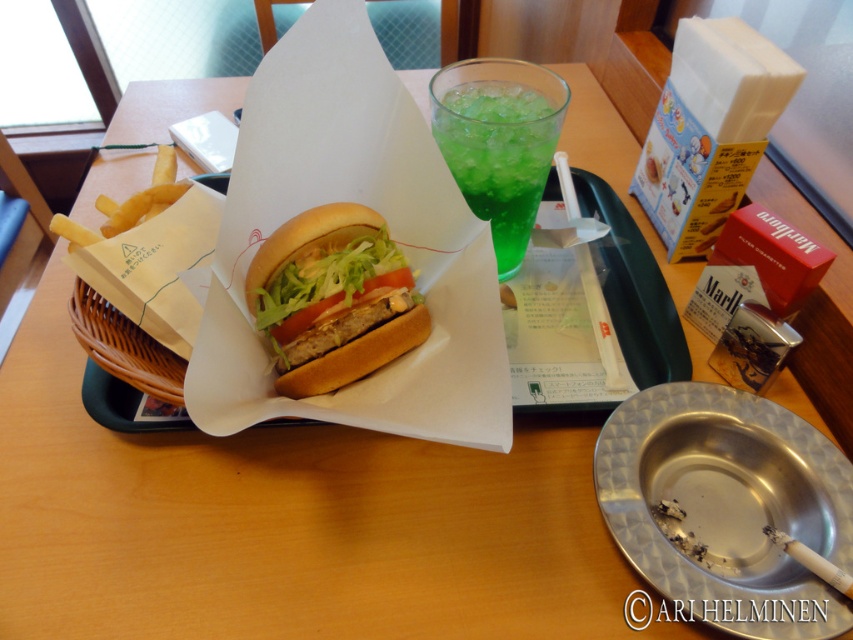
Question: Can you confirm if golden brown bun at center is thinner than green translucent glass at upper center?

Choices:
 (A) no
 (B) yes

Answer: (A)

Question: Which point is farther to the camera?

Choices:
 (A) (486, 81)
 (B) (712, 600)
 (C) (193, 204)
 (D) (277, 369)

Answer: (A)

Question: Is golden brown bun at center to the left of white paper burger at center from the viewer's perspective?

Choices:
 (A) yes
 (B) no

Answer: (A)

Question: Among these objects, which one is nearest to the camera?

Choices:
 (A) metallic ashtray at lower right
 (B) woven wood basket at left

Answer: (A)

Question: Which of the following is the closest to the observer?

Choices:
 (A) click(x=693, y=616)
 (B) click(x=339, y=294)

Answer: (A)

Question: Can you confirm if golden brown bun at center is positioned above white paper burger at center?

Choices:
 (A) no
 (B) yes

Answer: (B)